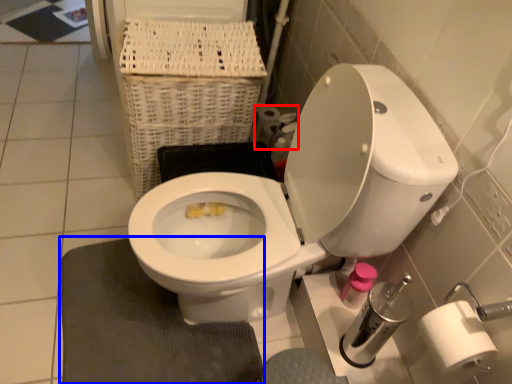
Question: Among these objects, which one is nearest to the camera, toilet paper (highlighted by a red box) or bath mat (highlighted by a blue box)?

Choices:
 (A) toilet paper
 (B) bath mat

Answer: (B)